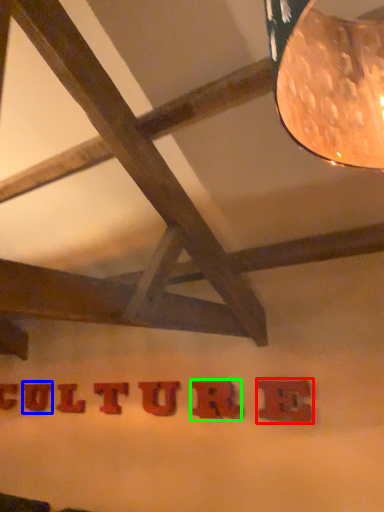
Question: Which object is the closest to the letter (highlighted by a red box)? Choose among these: letter (highlighted by a blue box) or letter (highlighted by a green box).

Choices:
 (A) letter
 (B) letter

Answer: (B)